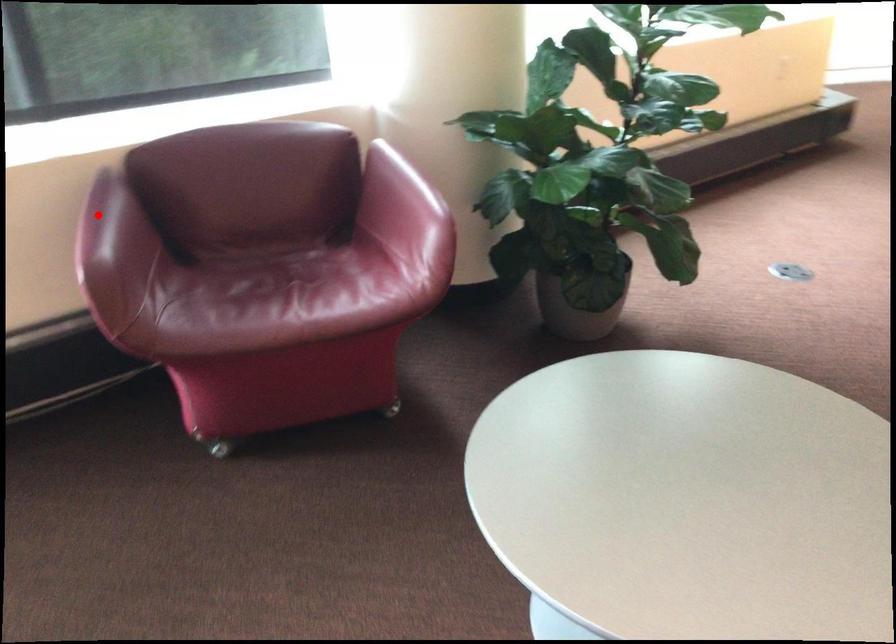
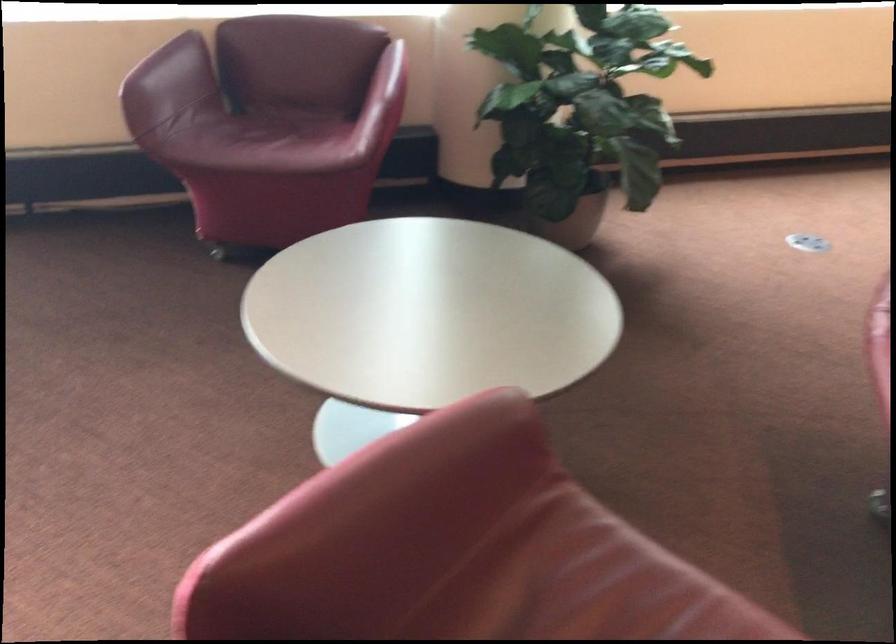
Find the pixel in the second image that matches the highlighted location in the first image.

(165, 57)